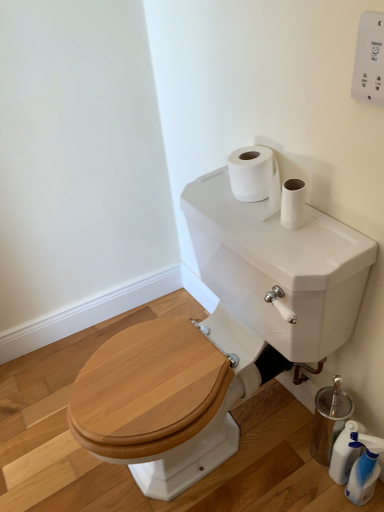
Question: Is the position of translucent plastic spray bottle at lower right, the second cleaning product from the back, less distant than that of white glossy tank at upper center?

Choices:
 (A) yes
 (B) no

Answer: (B)

Question: Does translucent plastic spray bottle at lower right, which is the 1th cleaning product in front-to-back order, appear on the left side of white glossy tank at upper center?

Choices:
 (A) yes
 (B) no

Answer: (B)

Question: Does translucent plastic spray bottle at lower right, the second cleaning product from the back, have a lesser height compared to white glossy tank at upper center?

Choices:
 (A) no
 (B) yes

Answer: (B)

Question: Is translucent plastic spray bottle at lower right, which is the 1th cleaning product in front-to-back order, wider than white glossy tank at upper center?

Choices:
 (A) no
 (B) yes

Answer: (A)

Question: Is translucent plastic spray bottle at lower right, the second cleaning product from the back, positioned beyond the bounds of white glossy tank at upper center?

Choices:
 (A) no
 (B) yes

Answer: (B)

Question: Is translucent plastic spray bottle at lower right, the second cleaning product from the back, thinner than white glossy tank at upper center?

Choices:
 (A) yes
 (B) no

Answer: (A)

Question: From the image's perspective, is white glossy tank at upper center located beneath translucent plastic bottle at lower right, which ranks as the 2th cleaning product in front-to-back order?

Choices:
 (A) no
 (B) yes

Answer: (A)

Question: From the image's perspective, is white glossy tank at upper center on top of translucent plastic bottle at lower right, marked as the 1th cleaning product in a back-to-front arrangement?

Choices:
 (A) no
 (B) yes

Answer: (B)

Question: Is white glossy tank at upper center wider than translucent plastic bottle at lower right, marked as the 1th cleaning product in a back-to-front arrangement?

Choices:
 (A) yes
 (B) no

Answer: (A)

Question: Does white glossy tank at upper center lie behind translucent plastic bottle at lower right, marked as the 1th cleaning product in a back-to-front arrangement?

Choices:
 (A) no
 (B) yes

Answer: (A)

Question: Does white glossy tank at upper center have a smaller size compared to translucent plastic bottle at lower right, marked as the 1th cleaning product in a back-to-front arrangement?

Choices:
 (A) no
 (B) yes

Answer: (A)

Question: Does white glossy tank at upper center appear on the left side of translucent plastic bottle at lower right, marked as the 1th cleaning product in a back-to-front arrangement?

Choices:
 (A) no
 (B) yes

Answer: (B)

Question: Is white glossy tank at upper center surrounding white plastic remote control at upper right?

Choices:
 (A) no
 (B) yes

Answer: (A)